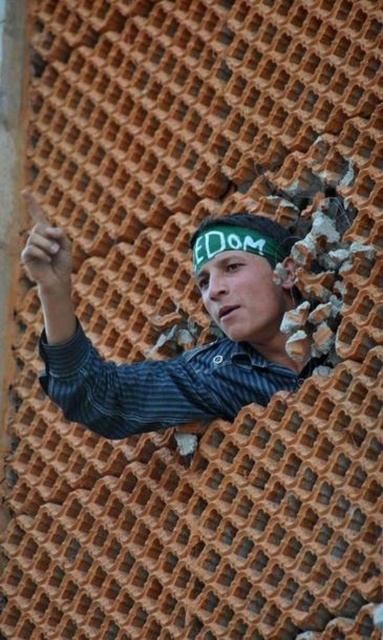
Question: Considering the real-world distances, which object is farthest from the green fabric headscarf at center?

Choices:
 (A) striped cotton shirt at center
 (B) striped shirt at upper left

Answer: (A)

Question: Which point appears farthest from the camera in this image?

Choices:
 (A) (70, 404)
 (B) (224, 240)
 (C) (281, 252)

Answer: (C)

Question: Which object is closer to the camera taking this photo?

Choices:
 (A) green fabric headscarf at center
 (B) striped cotton shirt at center

Answer: (B)

Question: Does striped shirt at upper left lie behind green fabric headscarf at center?

Choices:
 (A) yes
 (B) no

Answer: (B)

Question: In this image, where is striped shirt at upper left located relative to green fabric headscarf at center?

Choices:
 (A) right
 (B) left

Answer: (B)

Question: Does striped cotton shirt at center have a lesser width compared to green fabric headscarf at center?

Choices:
 (A) no
 (B) yes

Answer: (A)